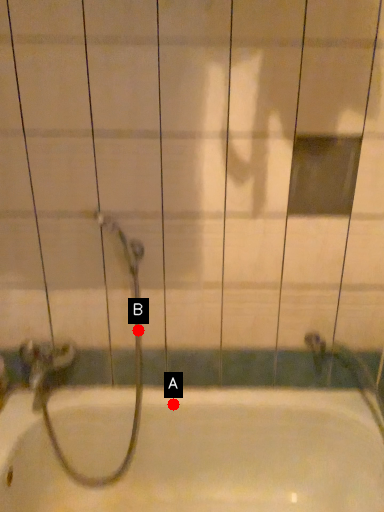
Question: Two points are circled on the image, labeled by A and B beside each circle. Which point is closer to the camera taking this photo?

Choices:
 (A) A is closer
 (B) B is closer

Answer: (B)